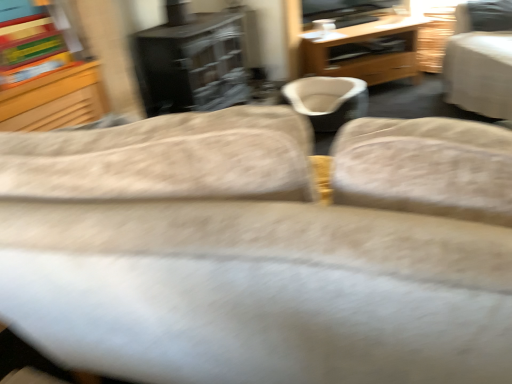
At what (x,y) coordinates should I click in order to perform the action: click on beige fabric bean bag chair at center. Please return your answer as a coordinate pair (x, y). Looking at the image, I should click on (328, 100).

The height and width of the screenshot is (384, 512). What do you see at coordinates (478, 69) in the screenshot?
I see `light gray fabric chair at upper right` at bounding box center [478, 69].

This screenshot has width=512, height=384. I want to click on wooden desk at center, so click(x=365, y=51).

Can light gray fabric chair at upper right be found inside wooden desk at center?

That's incorrect, light gray fabric chair at upper right is not inside wooden desk at center.

Measure the distance from wooden desk at center to light gray fabric chair at upper right.

A distance of 78.44 centimeters exists between wooden desk at center and light gray fabric chair at upper right.

Is light gray fabric chair at upper right at the back of wooden desk at center?

wooden desk at center does not have its back to light gray fabric chair at upper right.

In the scene shown: Between wooden desk at center and light gray fabric chair at upper right, which one has larger size?

Bigger between the two is light gray fabric chair at upper right.

Which of these two, wooden desk at center or beige fabric bean bag chair at center, is wider?

With larger width is wooden desk at center.

Considering the sizes of objects wooden desk at center and beige fabric bean bag chair at center in the image provided, who is taller, wooden desk at center or beige fabric bean bag chair at center?

With more height is wooden desk at center.

From the image's perspective, is wooden desk at center located beneath beige fabric bean bag chair at center?

No, from the image's perspective, wooden desk at center is not below beige fabric bean bag chair at center.

Between beige fabric bean bag chair at center and wooden desk at center, which one has smaller width?

beige fabric bean bag chair at center is thinner.

In the image, there is a wooden desk at center. Find the location of `bean bag chair below it (from a real-world perspective)`. bean bag chair below it (from a real-world perspective) is located at coordinates (328, 100).

Who is smaller, beige fabric bean bag chair at center or wooden desk at center?

Answer: With smaller size is beige fabric bean bag chair at center.

Considering the relative positions of beige fabric bean bag chair at center and wooden desk at center in the image provided, is beige fabric bean bag chair at center to the right of wooden desk at center from the viewer's perspective?

No, beige fabric bean bag chair at center is not to the right of wooden desk at center.

From the image's perspective, relative to light gray fabric chair at upper right, is beige fabric bean bag chair at center above or below?

From the image's perspective, beige fabric bean bag chair at center appears below light gray fabric chair at upper right.

Considering the positions of objects beige fabric bean bag chair at center and light gray fabric chair at upper right in the image provided, who is behind, beige fabric bean bag chair at center or light gray fabric chair at upper right?

beige fabric bean bag chair at center is further away from the camera.

Does point (342, 108) lie behind point (467, 100)?

Yes.

Could you measure the distance between beige fabric bean bag chair at center and light gray fabric chair at upper right?

The distance of beige fabric bean bag chair at center from light gray fabric chair at upper right is 75.94 centimeters.

Would you say light gray fabric chair at upper right is a long distance from wooden desk at center?

light gray fabric chair at upper right is near wooden desk at center, not far away.

Identify the location of desk above the light gray fabric chair at upper right (from the image's perspective). (365, 51).

Considering the sizes of objects light gray fabric chair at upper right and wooden desk at center in the image provided, who is shorter, light gray fabric chair at upper right or wooden desk at center?

Standing shorter between the two is wooden desk at center.

From the image's perspective, which one is positioned lower, light gray fabric chair at upper right or wooden desk at center?

light gray fabric chair at upper right appears lower in the image.

Between light gray fabric chair at upper right and beige fabric bean bag chair at center, which one has larger width?

light gray fabric chair at upper right is wider.

Considering the relative sizes of light gray fabric chair at upper right and beige fabric bean bag chair at center in the image provided, is light gray fabric chair at upper right shorter than beige fabric bean bag chair at center?

No.

Considering the relative sizes of light gray fabric chair at upper right and beige fabric bean bag chair at center in the image provided, is light gray fabric chair at upper right bigger than beige fabric bean bag chair at center?

Indeed, light gray fabric chair at upper right has a larger size compared to beige fabric bean bag chair at center.

Based on the photo, from the image's perspective, who appears lower, light gray fabric chair at upper right or beige fabric bean bag chair at center?

beige fabric bean bag chair at center, from the image's perspective.

This screenshot has height=384, width=512. Find the location of `desk behind the light gray fabric chair at upper right`. desk behind the light gray fabric chair at upper right is located at coordinates (365, 51).

In order to click on bean bag chair below the wooden desk at center (from a real-world perspective) in this screenshot , I will do `click(328, 100)`.

Which object lies nearer to the anchor point wooden desk at center, beige fabric bean bag chair at center or light gray fabric chair at upper right?

The object closer to wooden desk at center is beige fabric bean bag chair at center.

Which object lies further to the anchor point wooden desk at center, light gray fabric chair at upper right or beige fabric bean bag chair at center?

Based on the image, light gray fabric chair at upper right appears to be further to wooden desk at center.

From the image, which object appears to be nearer to beige fabric bean bag chair at center, light gray fabric chair at upper right or wooden desk at center?

wooden desk at center lies closer to beige fabric bean bag chair at center than the other object.

From the picture: Based on their spatial positions, is wooden desk at center or light gray fabric chair at upper right further from beige fabric bean bag chair at center?

The object further to beige fabric bean bag chair at center is light gray fabric chair at upper right.

When comparing their distances from light gray fabric chair at upper right, does wooden desk at center or beige fabric bean bag chair at center seem closer?

beige fabric bean bag chair at center is positioned closer to the anchor light gray fabric chair at upper right.

When comparing their distances from light gray fabric chair at upper right, does beige fabric bean bag chair at center or wooden desk at center seem closer?

beige fabric bean bag chair at center is closer to light gray fabric chair at upper right.

The image size is (512, 384). Find the location of `desk between beige fabric bean bag chair at center and light gray fabric chair at upper right from left to right`. desk between beige fabric bean bag chair at center and light gray fabric chair at upper right from left to right is located at coordinates (365, 51).